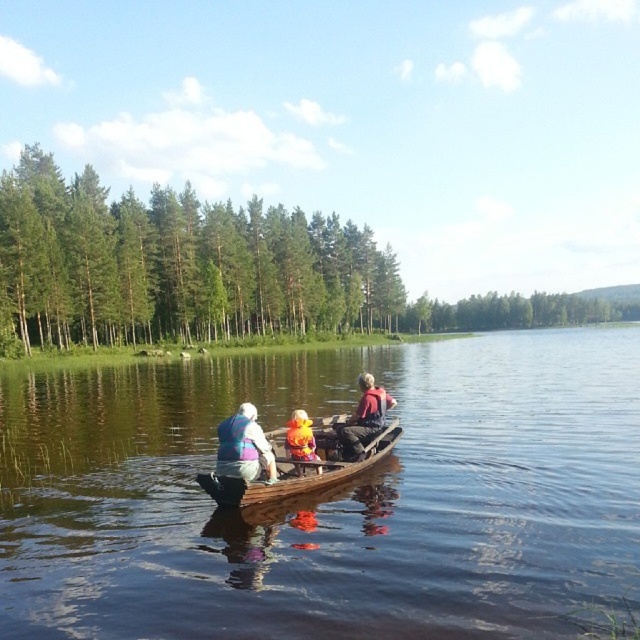
Question: Which of the following is the farthest from the observer?

Choices:
 (A) transparent water at boat center
 (B) wooden paddle at center

Answer: (B)

Question: Based on their relative distances, which object is nearer to the yellow fabric toy at center?

Choices:
 (A) brown wooden boat at center
 (B) white fabric backpack at lower left
 (C) transparent water at boat center

Answer: (A)

Question: Among these objects, which one is farthest from the camera?

Choices:
 (A) yellow fabric toy at center
 (B) transparent water at boat center
 (C) brown wooden boat at center
 (D) white fabric backpack at lower left

Answer: (C)

Question: Can you confirm if transparent water at boat center is wider than yellow fabric toy at center?

Choices:
 (A) yes
 (B) no

Answer: (A)

Question: Is white fabric backpack at lower left smaller than wooden paddle at center?

Choices:
 (A) yes
 (B) no

Answer: (B)

Question: Can you confirm if transparent water at boat center is wider than wooden paddle at center?

Choices:
 (A) no
 (B) yes

Answer: (B)